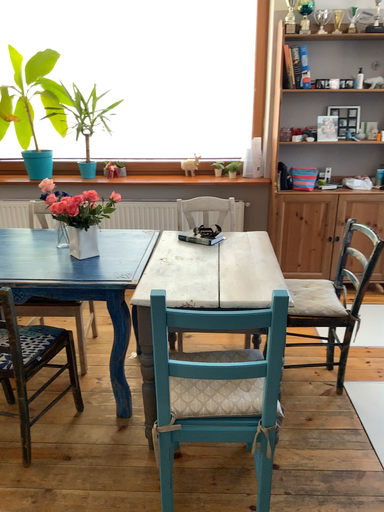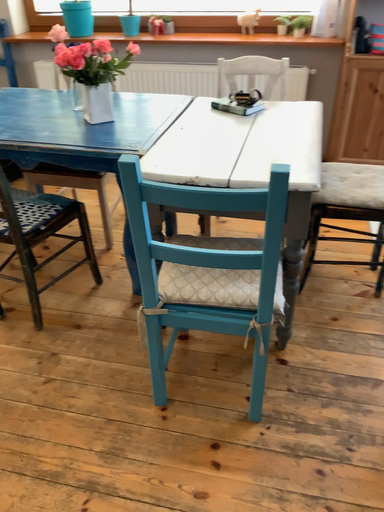
Question: How did the camera likely rotate when shooting the video?

Choices:
 (A) rotated upward
 (B) rotated downward

Answer: (B)